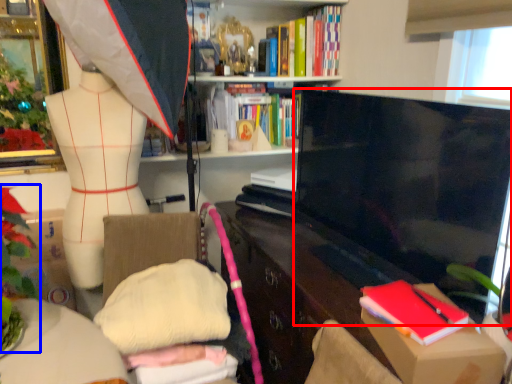
Question: Among these objects, which one is nearest to the camera, television (highlighted by a red box) or floral arrangement (highlighted by a blue box)?

Choices:
 (A) television
 (B) floral arrangement

Answer: (B)